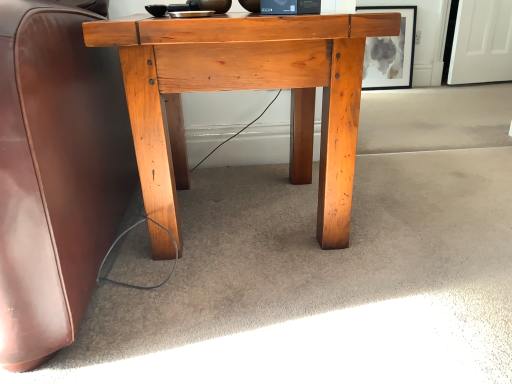
Question: Is matte black picture frame at upper center turned away from natural wood desk at center?

Choices:
 (A) no
 (B) yes

Answer: (A)

Question: Is matte black picture frame at upper center beside natural wood desk at center?

Choices:
 (A) yes
 (B) no

Answer: (B)

Question: From the image's perspective, is matte black picture frame at upper center on natural wood desk at center?

Choices:
 (A) yes
 (B) no

Answer: (A)

Question: Considering the relative positions of matte black picture frame at upper center and natural wood desk at center in the image provided, is matte black picture frame at upper center to the left of natural wood desk at center from the viewer's perspective?

Choices:
 (A) yes
 (B) no

Answer: (B)

Question: Does matte black picture frame at upper center have a smaller size compared to natural wood desk at center?

Choices:
 (A) yes
 (B) no

Answer: (A)

Question: Does matte black picture frame at upper center appear on the right side of natural wood desk at center?

Choices:
 (A) no
 (B) yes

Answer: (B)

Question: From the image's perspective, would you say natural wood desk at center is shown under matte black picture frame at upper center?

Choices:
 (A) no
 (B) yes

Answer: (B)

Question: From a real-world perspective, does natural wood desk at center stand above matte black picture frame at upper center?

Choices:
 (A) no
 (B) yes

Answer: (B)

Question: Can you confirm if natural wood desk at center is thinner than matte black picture frame at upper center?

Choices:
 (A) no
 (B) yes

Answer: (A)

Question: Is natural wood desk at center to the right of matte black picture frame at upper center from the viewer's perspective?

Choices:
 (A) yes
 (B) no

Answer: (B)

Question: Considering the relative sizes of natural wood desk at center and matte black picture frame at upper center in the image provided, is natural wood desk at center wider than matte black picture frame at upper center?

Choices:
 (A) no
 (B) yes

Answer: (B)

Question: Is natural wood desk at center smaller than matte black picture frame at upper center?

Choices:
 (A) yes
 (B) no

Answer: (B)

Question: Is matte black picture frame at upper center bigger or smaller than natural wood desk at center?

Choices:
 (A) big
 (B) small

Answer: (B)